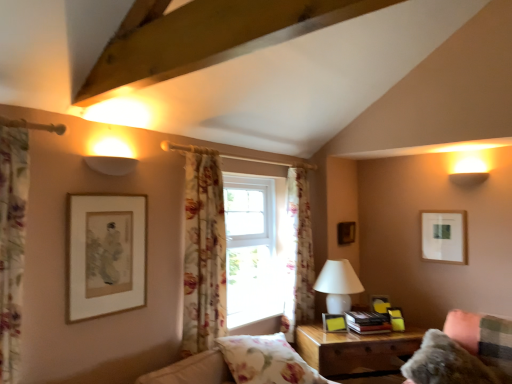
Question: Should I look upward or downward to see white glossy table lamp at center right?

Choices:
 (A) up
 (B) down

Answer: (B)

Question: Could you tell me if matte yellow picture frame at right, positioned as the 2th picture frame in left-to-right order, is turned towards wooden picture frame at upper right, marked as the fourth picture frame in a right-to-left arrangement?

Choices:
 (A) yes
 (B) no

Answer: (B)

Question: Would you say matte yellow picture frame at right, the fifth picture frame viewed from the back, is a long distance from wooden picture frame at upper right, marked as the fourth picture frame in a right-to-left arrangement?

Choices:
 (A) yes
 (B) no

Answer: (B)

Question: From a real-world perspective, is matte yellow picture frame at right, which is the second picture frame from front to back, over wooden picture frame at upper right, positioned as the 1th picture frame in back-to-front order?

Choices:
 (A) yes
 (B) no

Answer: (B)

Question: Does matte yellow picture frame at right, the fifth picture frame viewed from the back, come in front of wooden picture frame at upper right, marked as the fourth picture frame in a right-to-left arrangement?

Choices:
 (A) yes
 (B) no

Answer: (A)

Question: From the image's perspective, is matte yellow picture frame at right, which is counted as the fifth picture frame, starting from the right, under wooden picture frame at upper right, positioned as the 1th picture frame in back-to-front order?

Choices:
 (A) no
 (B) yes

Answer: (B)

Question: Is matte yellow picture frame at right, which is counted as the fifth picture frame, starting from the right, oriented away from wooden picture frame at upper right, the sixth picture frame positioned from the front?

Choices:
 (A) no
 (B) yes

Answer: (A)

Question: Would you say white glossy table lamp at center right is outside white matte picture frame at upper right, which is the second picture frame in back-to-front order?

Choices:
 (A) no
 (B) yes

Answer: (B)

Question: Considering the relative sizes of white glossy table lamp at center right and white matte picture frame at upper right, which is the second picture frame in back-to-front order, in the image provided, is white glossy table lamp at center right smaller than white matte picture frame at upper right, which is the second picture frame in back-to-front order,?

Choices:
 (A) no
 (B) yes

Answer: (A)

Question: Is white glossy table lamp at center right oriented away from white matte picture frame at upper right, which appears as the fifth picture frame when viewed from the front?

Choices:
 (A) yes
 (B) no

Answer: (B)

Question: From a real-world perspective, is white glossy table lamp at center right under white matte picture frame at upper right, which is the second picture frame in back-to-front order?

Choices:
 (A) yes
 (B) no

Answer: (A)

Question: From the image's perspective, is white glossy table lamp at center right beneath white matte picture frame at upper right, the first picture frame in the right-to-left sequence?

Choices:
 (A) yes
 (B) no

Answer: (A)

Question: Can white matte picture frame at upper right, the sixth picture frame positioned from the left, be found inside white glossy table lamp at center right?

Choices:
 (A) no
 (B) yes

Answer: (A)

Question: Is fuzzy fabric couch at lower right positioned before matte gold picture frame at lower right, the second picture frame in the right-to-left sequence?

Choices:
 (A) no
 (B) yes

Answer: (B)